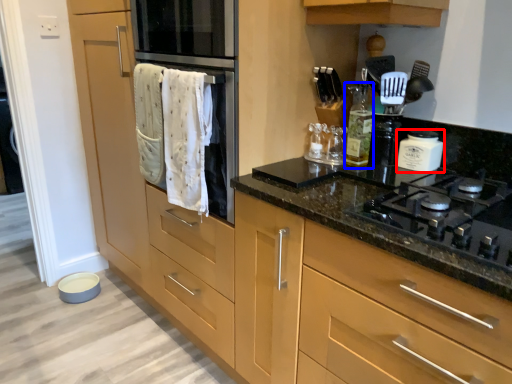
Question: Which of the following is the closest to the observer, kitchen appliance (highlighted by a red box) or bottle (highlighted by a blue box)?

Choices:
 (A) kitchen appliance
 (B) bottle

Answer: (A)